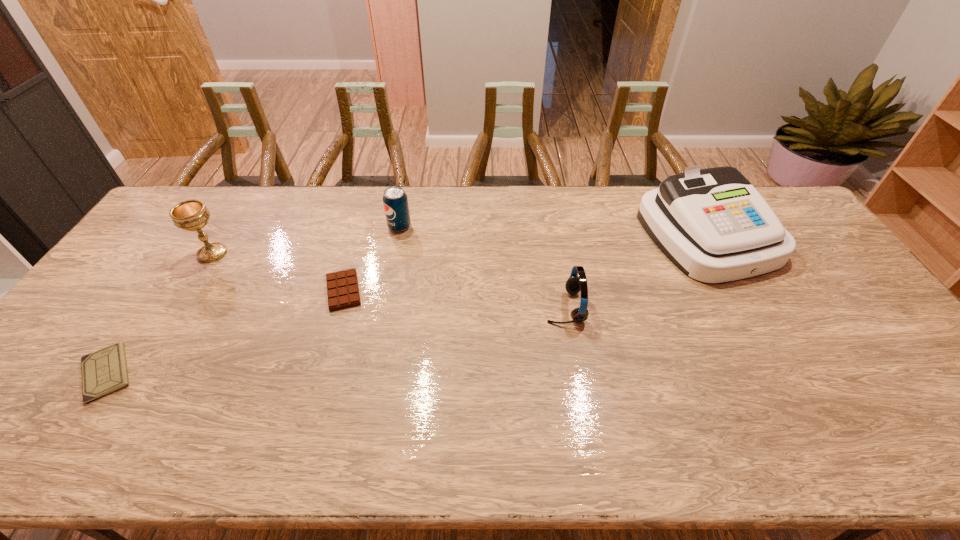
Where is `blank space located on the front of the soda can`? Image resolution: width=960 pixels, height=540 pixels. blank space located on the front of the soda can is located at coordinates (389, 280).

Find the location of a particular element. free space located with the microphone attached to the side of the second object from right to left is located at coordinates (502, 307).

You are a GUI agent. You are given a task and a screenshot of the screen. Output one action in this format:
    pyautogui.click(x=<x>, y=<y>)
    Task: Click on the free space located 0.290m with the microphone attached to the side of the second object from right to left
    Image resolution: width=960 pixels, height=540 pixels.
    Given the screenshot: What is the action you would take?
    pyautogui.click(x=442, y=307)

This screenshot has width=960, height=540. I want to click on free spot located with the microphone attached to the side of the second object from right to left, so click(417, 307).

At what (x,y) coordinates should I click in order to perform the action: click on free space located 0.240m on the front of the candy bar. Please return your answer as a coordinate pair (x, y). The height and width of the screenshot is (540, 960). Looking at the image, I should click on (315, 389).

I want to click on vacant space located on the back of the shortest object, so click(x=183, y=259).

Locate an element on the screen. Image resolution: width=960 pixels, height=540 pixels. cash register located at the far edge is located at coordinates (712, 224).

This screenshot has height=540, width=960. What are the coordinates of `soda can that is at the far edge` in the screenshot? It's located at click(x=395, y=201).

The image size is (960, 540). Find the location of `object that is at the left edge`. object that is at the left edge is located at coordinates (105, 371).

The height and width of the screenshot is (540, 960). In order to click on object that is at the right edge in this screenshot , I will do `click(712, 224)`.